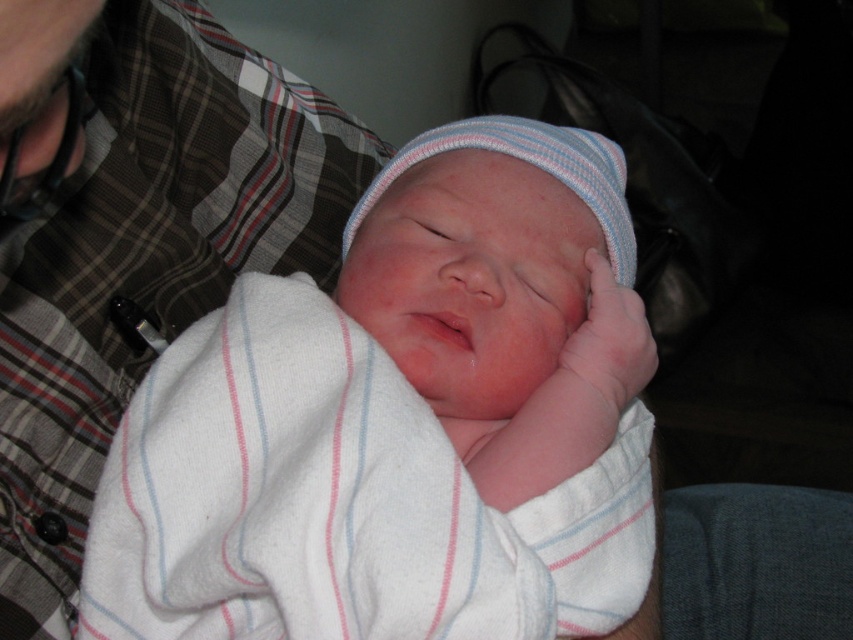
You are a photographer trying to capture the baby in the scene. The white striped blanket at center and the pink soft fabric hand at center are both in the frame. Which object is wider?

The white striped blanket at center is wider than the pink soft fabric hand at center.

Looking at this image, you are a photographer capturing a newborn baby in a studio. You notice the white striped blanket at center and the pink soft fabric hand at center. From the camera lens perspective, which object is closer to the camera?

The white striped blanket at center is closer to the camera because it is in front of the pink soft fabric hand at center.

You are a photographer taking a picture of the newborn baby and the person in the plaid shirt. You notice two points in the scene at coordinates point (x=601, y=243) and point (x=654, y=360). Which point is closer to you?

Point (x=601, y=243) is further to the viewer than point (x=654, y=360), so the point closer to you is point (x=654, y=360).